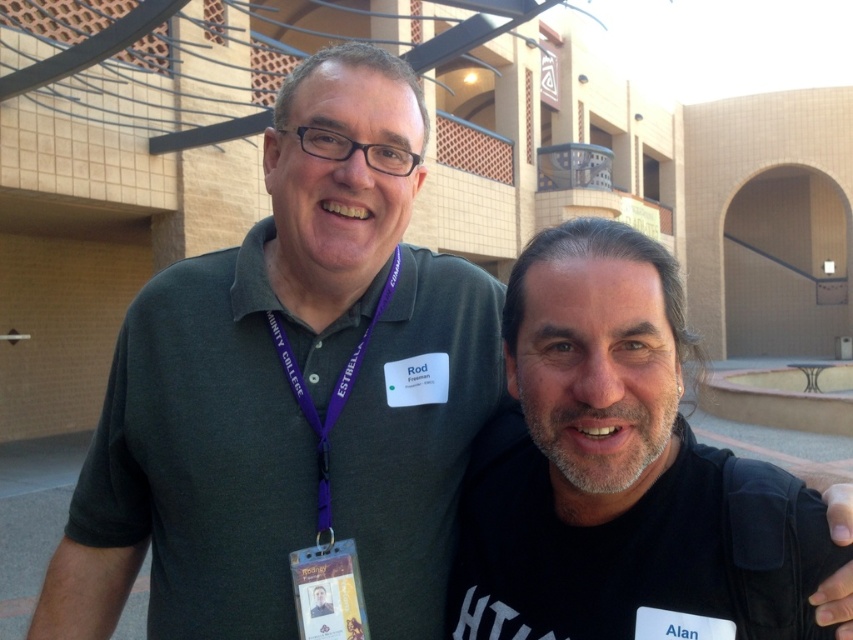
The image size is (853, 640). Describe the element at coordinates (602, 464) in the screenshot. I see `gray beard at center` at that location.

Does gray beard at center have a larger size compared to matte green shirt at center?

Incorrect, gray beard at center is not larger than matte green shirt at center.

Locate an element on the screen. gray beard at center is located at coordinates (602, 464).

Which is behind, point (688, 557) or point (645, 483)?

Point (645, 483)

Is point (514, 419) less distant than point (639, 442)?

No, (514, 419) is behind (639, 442).

The height and width of the screenshot is (640, 853). I want to click on dark gray t-shirt at right, so click(608, 465).

Who is taller, dark gray t-shirt at right or matte green shirt at center?

Standing taller between the two is dark gray t-shirt at right.

Which is above, dark gray t-shirt at right or matte green shirt at center?

Positioned higher is matte green shirt at center.

Between point (514, 506) and point (345, 252), which one is positioned behind?

Point (514, 506)

Locate an element on the screen. Image resolution: width=853 pixels, height=640 pixels. dark gray t-shirt at right is located at coordinates (608, 465).